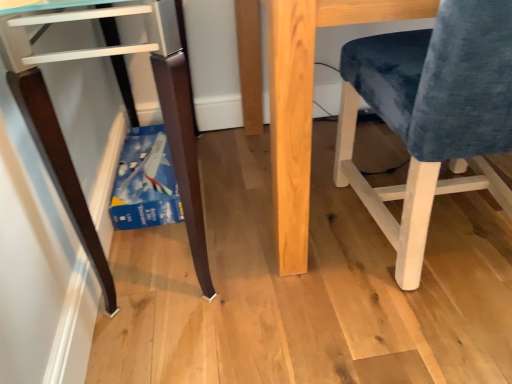
Locate an element on the screen. The height and width of the screenshot is (384, 512). matte dark wood desk at lower left is located at coordinates (127, 110).

What do you see at coordinates (307, 102) in the screenshot?
I see `natural wood table at center` at bounding box center [307, 102].

Where is `matte dark wood desk at lower left`? matte dark wood desk at lower left is located at coordinates (127, 110).

Who is more distant, velvet blue chair at right or natural wood table at center?

natural wood table at center is behind.

Could natural wood table at center be considered to be inside velvet blue chair at right?

Definitely not — natural wood table at center is not inside velvet blue chair at right.

Based on the photo, considering the relative positions of velvet blue chair at right and natural wood table at center in the image provided, is velvet blue chair at right to the left or to the right of natural wood table at center?

From the image, it's evident that velvet blue chair at right is to the right of natural wood table at center.

From a real-world perspective, is velvet blue chair at right positioned above or below natural wood table at center?

In terms of real-world spatial position, velvet blue chair at right is above natural wood table at center.

Is matte dark wood desk at lower left positioned with its back to velvet blue chair at right?

That's not correct — matte dark wood desk at lower left is not looking away from velvet blue chair at right.

From the image's perspective, between matte dark wood desk at lower left and velvet blue chair at right, who is located below?

velvet blue chair at right.

What's the angular difference between matte dark wood desk at lower left and velvet blue chair at right's facing directions?

matte dark wood desk at lower left and velvet blue chair at right are facing 88.9 degrees away from each other.

Is matte dark wood desk at lower left situated inside velvet blue chair at right or outside?

matte dark wood desk at lower left is spatially situated outside velvet blue chair at right.

Which object is closer to the camera, matte dark wood desk at lower left or natural wood table at center?

matte dark wood desk at lower left is closer to the camera.

Is matte dark wood desk at lower left looking in the opposite direction of natural wood table at center?

Yes, matte dark wood desk at lower left is positioned with its back facing natural wood table at center.

From the image's perspective, does matte dark wood desk at lower left appear higher than natural wood table at center?

Incorrect, from the image's perspective, matte dark wood desk at lower left is lower than natural wood table at center.

Can you confirm if natural wood table at center is wider than velvet blue chair at right?

Yes.

Is there a large distance between natural wood table at center and velvet blue chair at right?

Actually, natural wood table at center and velvet blue chair at right are a little close together.

From a real-world perspective, which object rests below the other?

natural wood table at center.

Would you say natural wood table at center is inside or outside velvet blue chair at right?

natural wood table at center is not inside velvet blue chair at right, it's outside.

Can you see natural wood table at center touching matte dark wood desk at lower left?

No, natural wood table at center is not touching matte dark wood desk at lower left.

Is natural wood table at center positioned behind matte dark wood desk at lower left?

Yes, natural wood table at center is behind matte dark wood desk at lower left.

In the image, is natural wood table at center on the left side or the right side of matte dark wood desk at lower left?

Based on their positions, natural wood table at center is located to the right of matte dark wood desk at lower left.

Is matte dark wood desk at lower left at the back of natural wood table at center?

No.

Is point (465, 17) behind point (195, 162)?

No.

Looking at this image, is velvet blue chair at right positioned with its back to matte dark wood desk at lower left?

That's not correct — velvet blue chair at right is not looking away from matte dark wood desk at lower left.

In the scene shown: Does velvet blue chair at right have a greater width compared to matte dark wood desk at lower left?

Yes.

This screenshot has width=512, height=384. In order to click on table behind the velvet blue chair at right in this screenshot , I will do `click(307, 102)`.

In the image, there is a velvet blue chair at right. Where is `furniture above it (from the image's perspective)`? The height and width of the screenshot is (384, 512). furniture above it (from the image's perspective) is located at coordinates (127, 110).

When comparing their distances from velvet blue chair at right, does natural wood table at center or matte dark wood desk at lower left seem closer?

The object closer to velvet blue chair at right is natural wood table at center.

Looking at the image, which one is located further to matte dark wood desk at lower left, natural wood table at center or velvet blue chair at right?

Based on the image, velvet blue chair at right appears to be further to matte dark wood desk at lower left.

From the image, which object appears to be farther from natural wood table at center, velvet blue chair at right or matte dark wood desk at lower left?

matte dark wood desk at lower left lies further to natural wood table at center than the other object.

Consider the image. Which object lies further to the anchor point natural wood table at center, matte dark wood desk at lower left or velvet blue chair at right?

matte dark wood desk at lower left is further to natural wood table at center.

Considering their positions, is velvet blue chair at right positioned further to matte dark wood desk at lower left than natural wood table at center?

Based on the image, velvet blue chair at right appears to be further to matte dark wood desk at lower left.

Which object lies nearer to the anchor point velvet blue chair at right, matte dark wood desk at lower left or natural wood table at center?

The object closer to velvet blue chair at right is natural wood table at center.

Identify the location of table between matte dark wood desk at lower left and velvet blue chair at right from left to right. This screenshot has height=384, width=512. (307, 102).